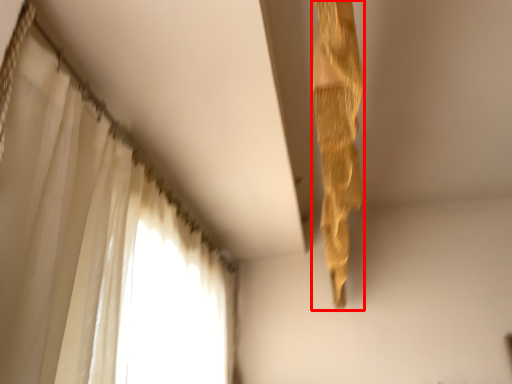
Question: From the image's perspective, where is curtain (annotated by the red box) located relative to curtain?

Choices:
 (A) below
 (B) above

Answer: (A)